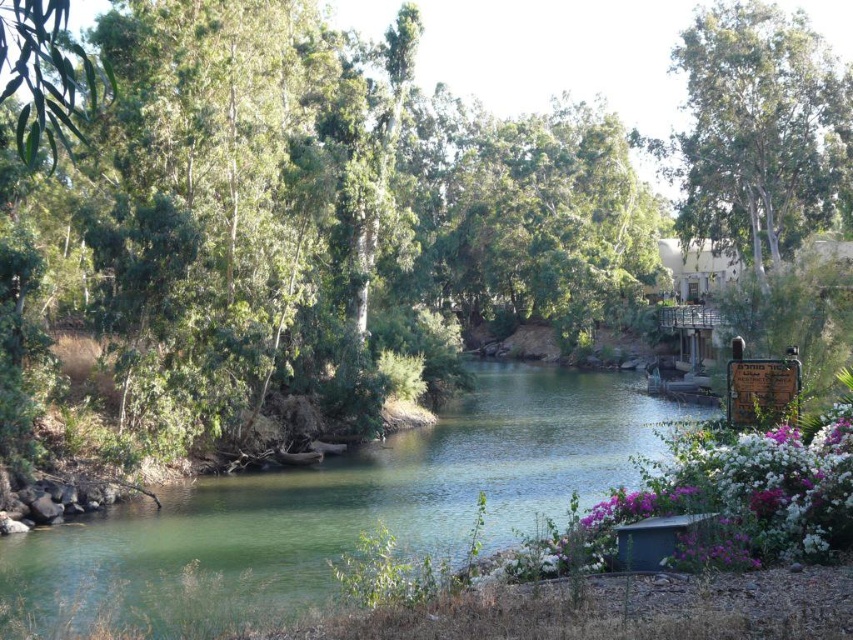
Question: Which point appears closest to the camera in this image?

Choices:
 (A) (238, 557)
 (B) (320, 397)

Answer: (A)

Question: Which of these objects is positioned closest to the green smooth water at center?

Choices:
 (A) green leafy tree at center
 (B) white matte flowers at lower right

Answer: (B)

Question: Where is green leafy tree at center located in relation to white matte flowers at lower right in the image?

Choices:
 (A) left
 (B) right

Answer: (A)

Question: Which object is the closest to the white matte flowers at lower right?

Choices:
 (A) green leafy tree at center
 (B) green smooth water at center

Answer: (B)

Question: Is green leafy tree at center wider than white matte flowers at lower right?

Choices:
 (A) no
 (B) yes

Answer: (B)

Question: Does green smooth water at center lie behind white matte flowers at lower right?

Choices:
 (A) yes
 (B) no

Answer: (B)